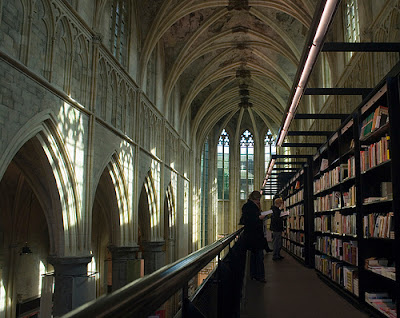
Where is `opened book`? The height and width of the screenshot is (318, 400). opened book is located at coordinates (265, 214), (286, 211).